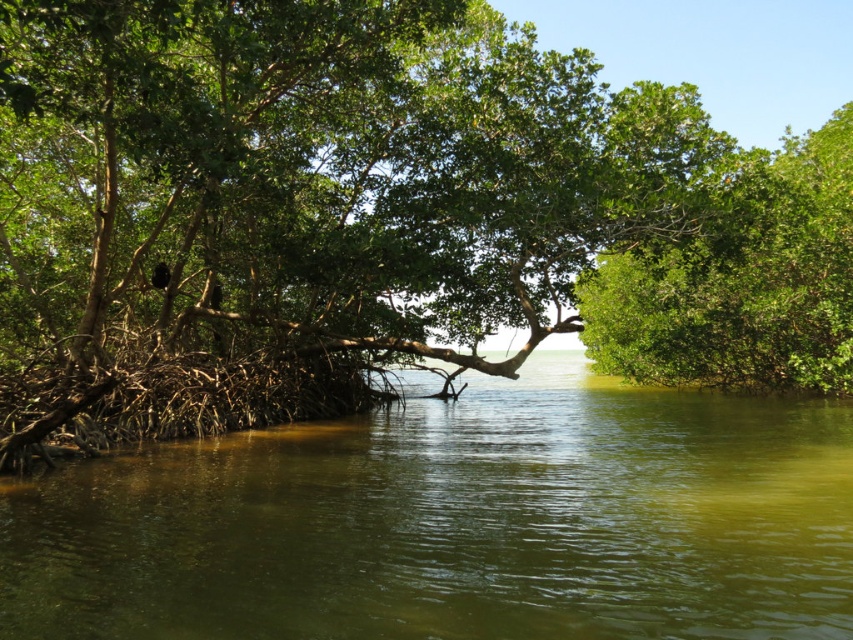
Question: Which of the following is the farthest from the observer?

Choices:
 (A) (416, 541)
 (B) (741, 244)

Answer: (B)

Question: Does green murky water at center appear under green leafy tree at right?

Choices:
 (A) yes
 (B) no

Answer: (A)

Question: Is green murky water at center above green leafy tree at right?

Choices:
 (A) no
 (B) yes

Answer: (A)

Question: Does green leafy tree at center have a greater width compared to green leafy tree at right?

Choices:
 (A) no
 (B) yes

Answer: (B)

Question: Among these objects, which one is nearest to the camera?

Choices:
 (A) green leafy tree at right
 (B) green leafy tree at center

Answer: (B)

Question: Considering the real-world distances, which object is closest to the green murky water at center?

Choices:
 (A) green leafy tree at right
 (B) green leafy tree at center

Answer: (B)